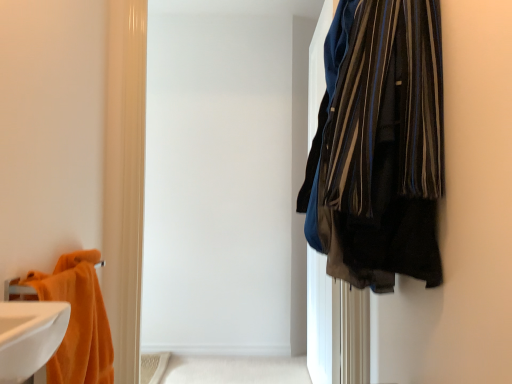
Question: In the image, is beige fabric bath mat at lower center positioned in front of or behind orange plush towel at left?

Choices:
 (A) front
 (B) behind

Answer: (B)

Question: Is beige fabric bath mat at lower center inside or outside of orange plush towel at left?

Choices:
 (A) inside
 (B) outside

Answer: (B)

Question: From the image's perspective, is beige fabric bath mat at lower center above or below orange plush towel at left?

Choices:
 (A) below
 (B) above

Answer: (A)

Question: Considering the positions of orange plush towel at left and beige fabric bath mat at lower center in the image, is orange plush towel at left wider or thinner than beige fabric bath mat at lower center?

Choices:
 (A) wide
 (B) thin

Answer: (B)

Question: From a real-world perspective, is orange plush towel at left physically located above or below beige fabric bath mat at lower center?

Choices:
 (A) below
 (B) above

Answer: (B)

Question: Is point (97, 334) closer or farther from the camera than point (279, 367)?

Choices:
 (A) closer
 (B) farther

Answer: (A)

Question: Is orange plush towel at left in front of or behind beige fabric bath mat at lower center in the image?

Choices:
 (A) front
 (B) behind

Answer: (A)